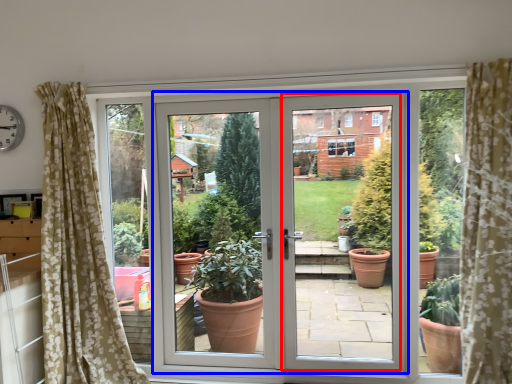
Question: Among these objects, which one is farthest to the camera, screen door (highlighted by a red box) or door (highlighted by a blue box)?

Choices:
 (A) screen door
 (B) door

Answer: (A)